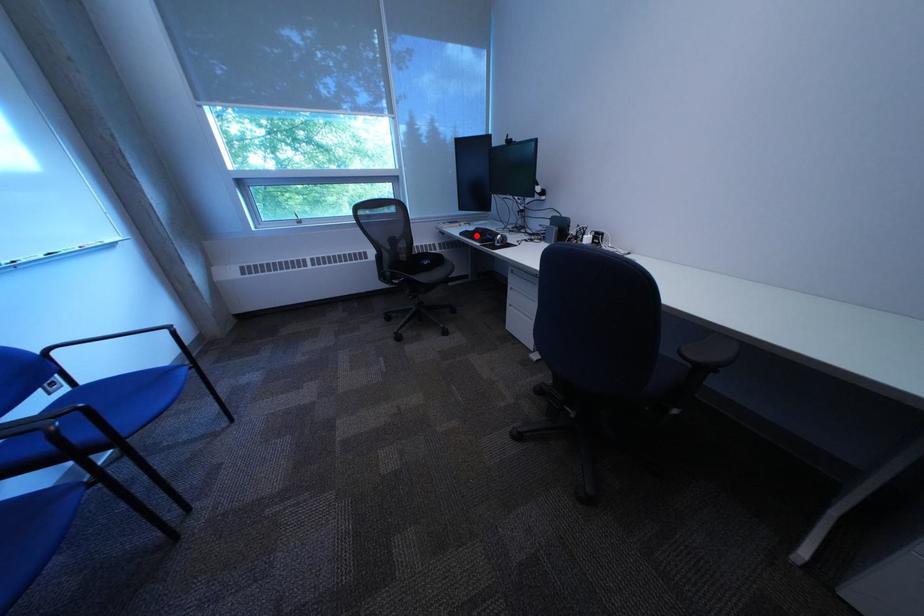
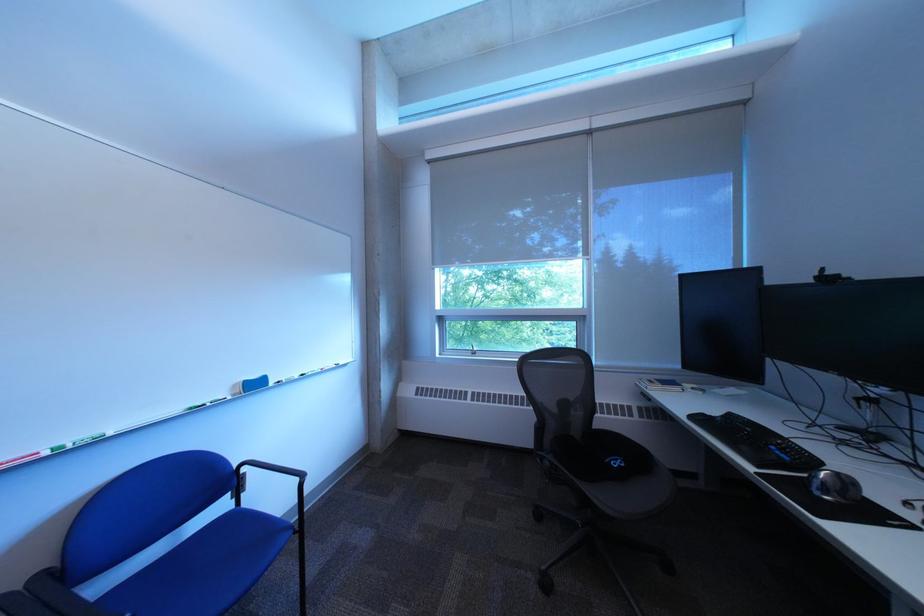
Question: I am providing you with two images of the same scene from different viewpoints. A red point is shown in image1. For the corresponding object point in image2, is it positioned nearer or farther from the camera?

Choices:
 (A) Nearer
 (B) Farther

Answer: (B)